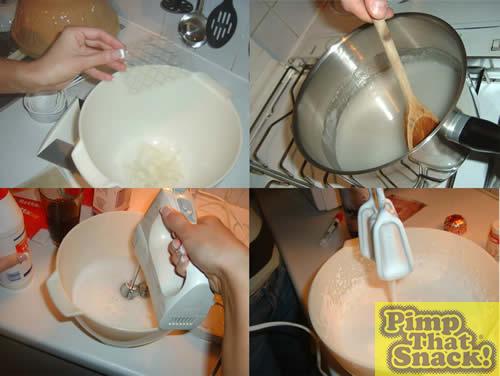
Where is `handle`? The image size is (500, 376). handle is located at coordinates (443, 138).